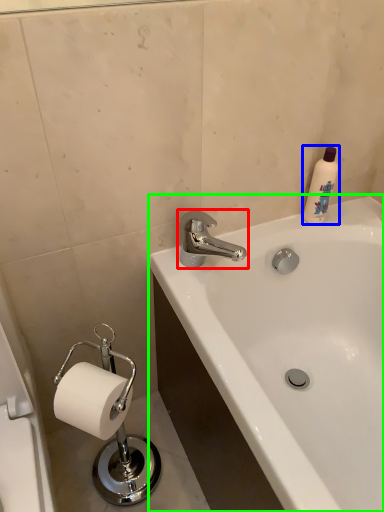
Question: Estimate the real-world distances between objects in this image. Which object is farther from tap (highlighted by a red box), cleaning product (highlighted by a blue box) or bathtub (highlighted by a green box)?

Choices:
 (A) cleaning product
 (B) bathtub

Answer: (B)